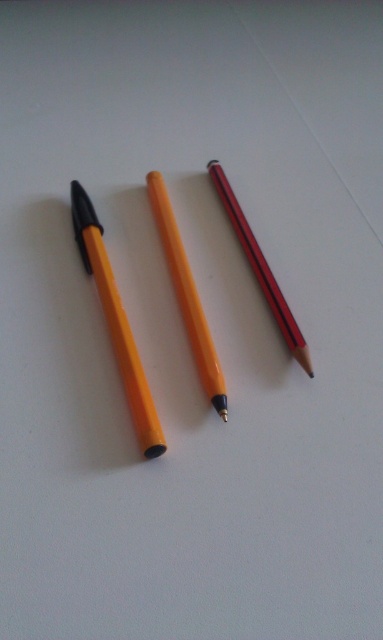
You are organizing a stationery set and need to place the matte orange pen at left and the matte red pencil at center into a narrow case. Based on their widths, which one might not fit if the case has a width limit?

The matte orange pen at left has a greater width than the matte red pencil at center, so it might not fit into the narrow case first.

Which pen has the point at coordinate [116,323]?

The point at coordinate [116,323] is on the matte orange pen at left.